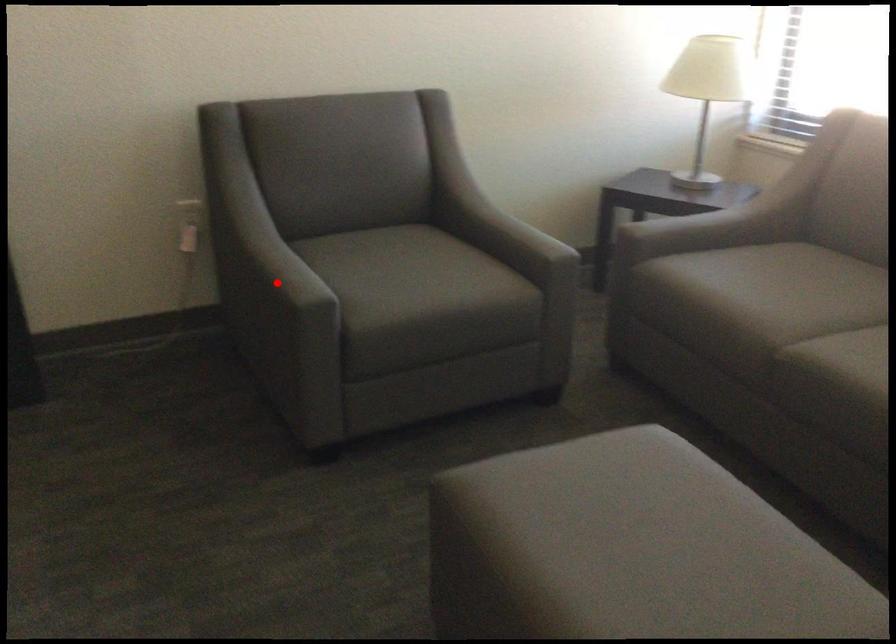
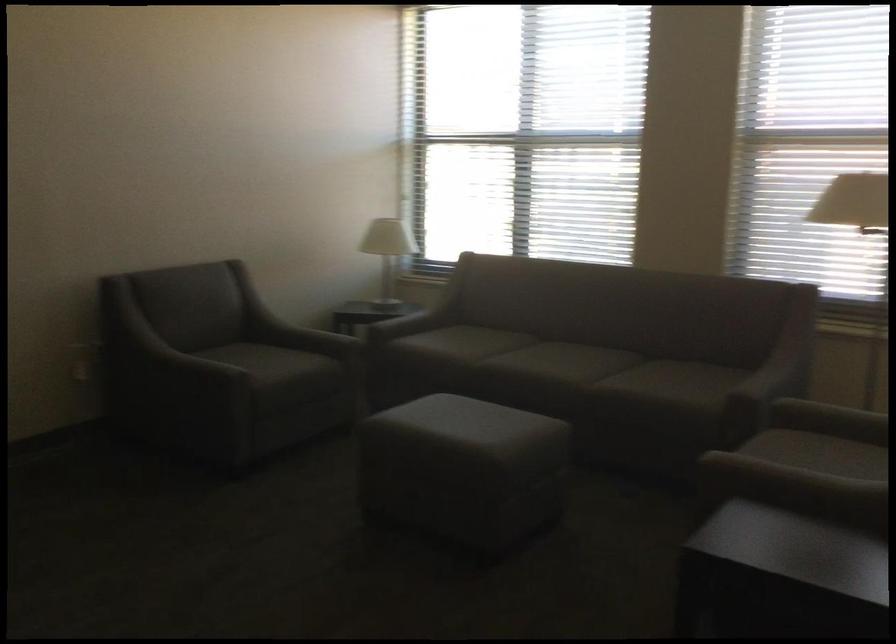
Question: I am providing you with two images of the same scene from different viewpoints. In image1, a red point is highlighted. Considering the same 3D point in image2, which of the following is correct?

Choices:
 (A) It is closer
 (B) It is farther

Answer: (B)